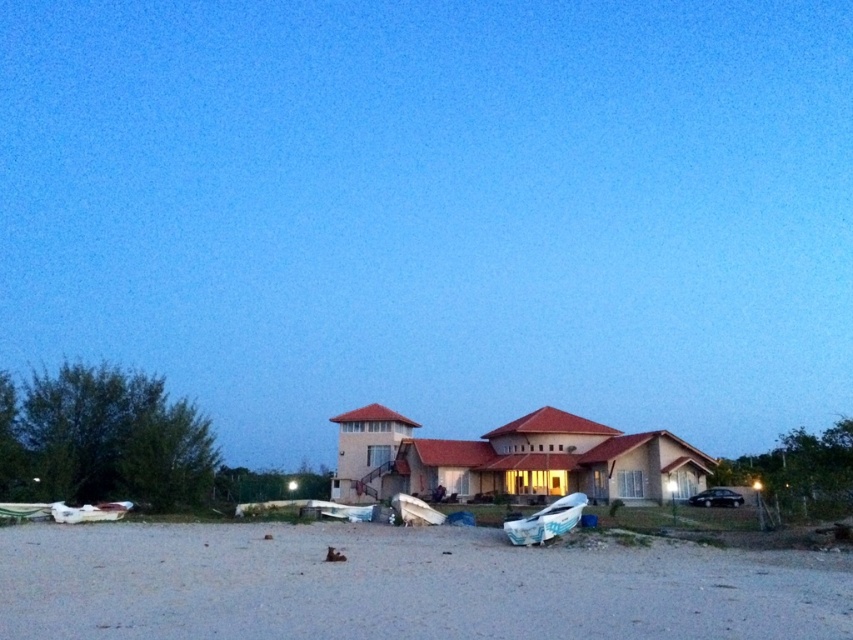
In the scene shown: You are a delivery person trying to park your 2.5 meter long truck near the gray gravel at lower center and the white plastic boat at lower center. Can you fit your truck between them without hitting either object?

The distance between the gray gravel at lower center and the white plastic boat at lower center is 9.53 meters. Since your truck is only 2.5 meters long, there is sufficient space to park between them without any issues.

You are a visitor arriving at the house and notice the white plastic boat at lower center and the white matte boat at center. Which boat is closer to you?

The white plastic boat at lower center is closer to you because it is positioned over the white matte boat at center, indicating it is in front.

You are planning to move the white matte boat at lower left and the white matte boat at center to a storage area. Which boat requires more space in the storage area?

The white matte boat at center requires more space in the storage area because it is larger than the white matte boat at lower left.